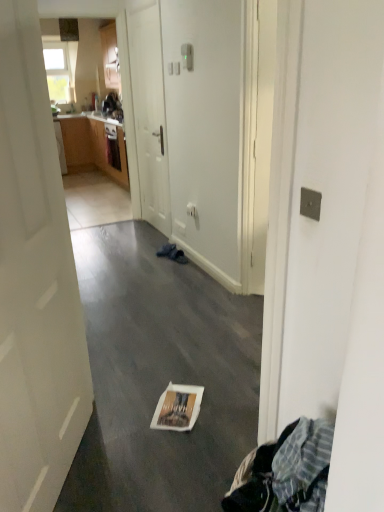
Question: Can you confirm if white glossy door at left, arranged as the 1th door when viewed from the front, is thinner than white glossy magazine at center?

Choices:
 (A) no
 (B) yes

Answer: (B)

Question: Is white glossy door at left, the 2th door viewed from the back, not within white glossy magazine at center?

Choices:
 (A) yes
 (B) no

Answer: (A)

Question: Is white glossy door at left, arranged as the 1th door when viewed from the front, smaller than white glossy magazine at center?

Choices:
 (A) yes
 (B) no

Answer: (B)

Question: Is white glossy door at left, the 2th door viewed from the back, far away from white glossy magazine at center?

Choices:
 (A) no
 (B) yes

Answer: (A)

Question: From the image's perspective, is white glossy door at left, the 2th door viewed from the back, beneath white glossy magazine at center?

Choices:
 (A) yes
 (B) no

Answer: (B)

Question: Is white glossy door at left, the 2th door viewed from the back, oriented towards white glossy magazine at center?

Choices:
 (A) yes
 (B) no

Answer: (A)

Question: From a real-world perspective, is white matte door at center, the first door viewed from the back, located beneath white glossy door at left, the 2th door viewed from the back?

Choices:
 (A) no
 (B) yes

Answer: (A)

Question: Can you confirm if white matte door at center, which is the second door from front to back, is thinner than white glossy door at left, the 2th door viewed from the back?

Choices:
 (A) yes
 (B) no

Answer: (B)

Question: Could white glossy door at left, the 2th door viewed from the back, be considered to be inside white matte door at center, which is the second door from front to back?

Choices:
 (A) yes
 (B) no

Answer: (B)

Question: Is white matte door at center, the first door viewed from the back, oriented towards white glossy door at left, arranged as the 1th door when viewed from the front?

Choices:
 (A) no
 (B) yes

Answer: (A)

Question: From a real-world perspective, is white matte door at center, the first door viewed from the back, on white glossy door at left, the 2th door viewed from the back?

Choices:
 (A) yes
 (B) no

Answer: (A)

Question: Is white matte door at center, the first door viewed from the back, wider than white glossy door at left, the 2th door viewed from the back?

Choices:
 (A) no
 (B) yes

Answer: (B)

Question: Can you confirm if white paper bag at center is smaller than white glossy door at left, arranged as the 1th door when viewed from the front?

Choices:
 (A) yes
 (B) no

Answer: (B)